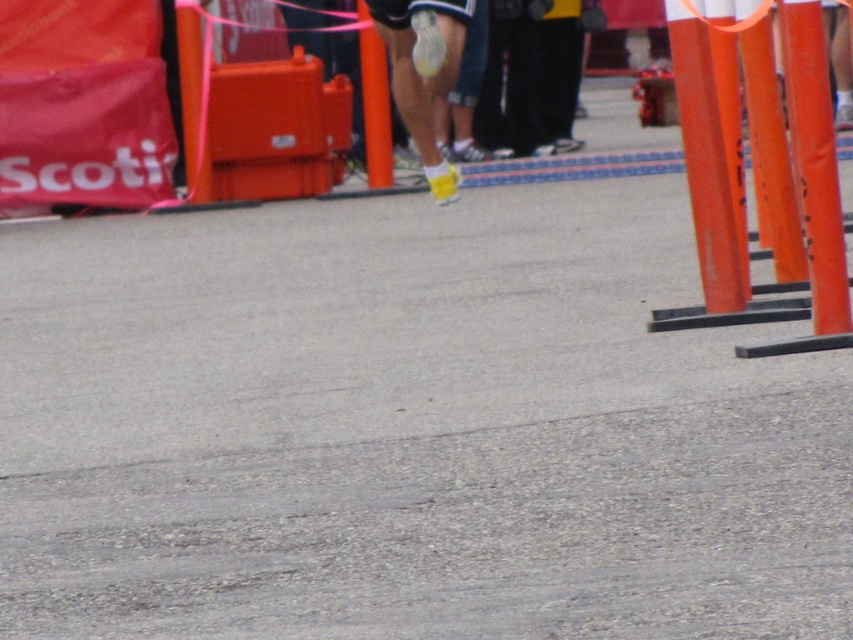
Does point (831, 257) come behind point (370, 113)?

No, it is not.

The image size is (853, 640). I want to click on orange matte pole at center-right, so click(x=815, y=163).

This screenshot has width=853, height=640. Find the location of `orange matte pole at center-right`. orange matte pole at center-right is located at coordinates (815, 163).

Looking at this image, who is positioned more to the left, orange matte pole at center-right or yellow matte socks at center?

Positioned to the left is yellow matte socks at center.

Is orange matte pole at center-right below yellow matte socks at center?

Correct, orange matte pole at center-right is located below yellow matte socks at center.

Locate an element on the screen. orange matte pole at center-right is located at coordinates (815, 163).

What do you see at coordinates (422, 77) in the screenshot? This screenshot has width=853, height=640. I see `yellow matte socks at center` at bounding box center [422, 77].

I want to click on yellow matte socks at center, so click(x=422, y=77).

Where is `yellow matte socks at center`? Image resolution: width=853 pixels, height=640 pixels. yellow matte socks at center is located at coordinates (422, 77).